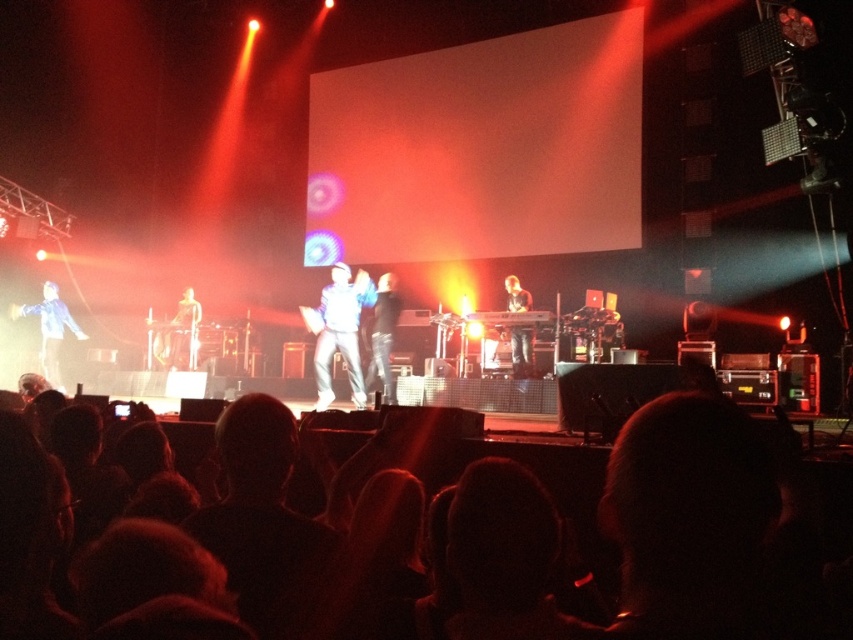
What do you see at coordinates (492, 454) in the screenshot?
I see `black hair at lower center` at bounding box center [492, 454].

Consider the image. Is black hair at lower center above white matte jacket at center?

Actually, black hair at lower center is below white matte jacket at center.

Is point (425, 412) more distant than point (350, 353)?

No.

At what (x,y) coordinates should I click in order to perform the action: click on black hair at lower center. Please return your answer as a coordinate pair (x, y). Looking at the image, I should click on (492, 454).

Does white matte jacket at center appear on the left side of matte white figure at center?

Incorrect, white matte jacket at center is not on the left side of matte white figure at center.

Who is more distant from viewer, (318, 308) or (183, 326)?

The point (183, 326) is behind.

Identify the location of white matte jacket at center. (340, 332).

Which is more to the left, denim jacket at left or matte white figure at center?

denim jacket at left

Can you confirm if denim jacket at left is positioned to the right of matte white figure at center?

Incorrect, denim jacket at left is not on the right side of matte white figure at center.

Who is more distant from viewer, (55,301) or (189,310)?

The point (189,310) is more distant.

Identify the location of denim jacket at left. The image size is (853, 640). (50, 330).